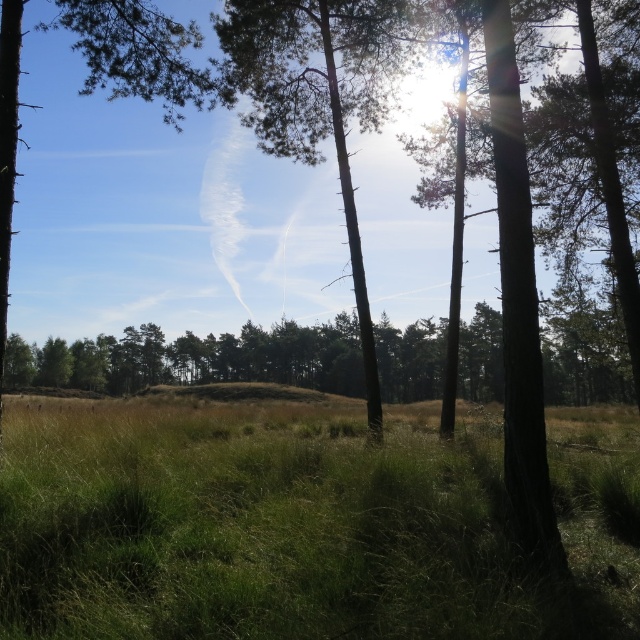
You are standing in the forest scene and want to walk from the point at coordinates point (616, 484) to the point at coordinates point (321, 136). Which direction should you face to move towards the second point?

To move from point (616, 484) to point (321, 136), you should face towards the upper left direction since point (321, 136) is further away from the camera compared to point (616, 484).